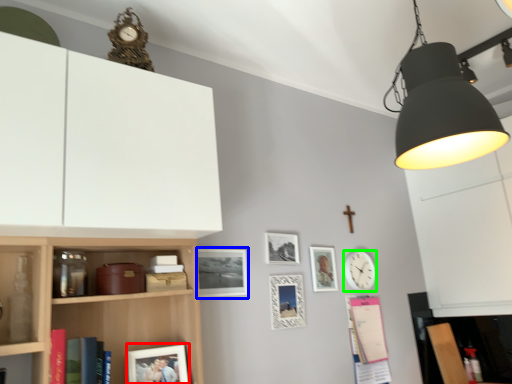
Question: Which object is positioned closest to picture frame (highlighted by a red box)? Select from picture frame (highlighted by a blue box) and clock (highlighted by a green box).

Choices:
 (A) picture frame
 (B) clock

Answer: (A)